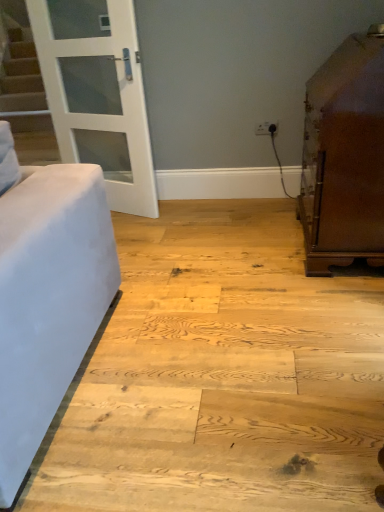
You are a GUI agent. You are given a task and a screenshot of the screen. Output one action in this format:
    pyautogui.click(x=<x>, y=<y>)
    Task: Click on the vacant space in front of brown polished cabinet at right
    This screenshot has height=512, width=384.
    Given the screenshot: What is the action you would take?
    pyautogui.click(x=325, y=310)